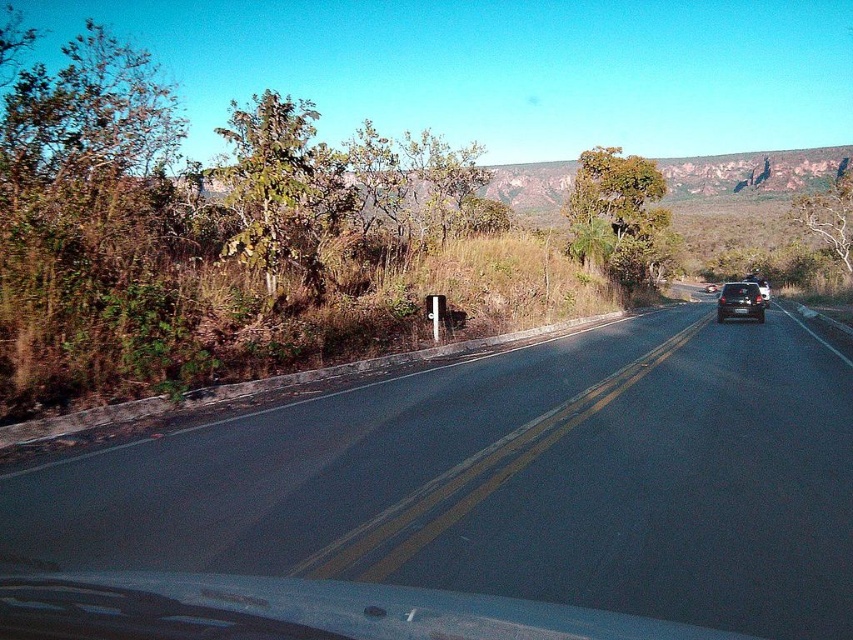
You are driving a car that is exactly the same width as the satin black car at right. You need to cross a bridge ahead that has a weight limit sign stating it can only handle vehicles up to the width of the black asphalt road at center. Will your car fit through the bridge?

The black asphalt road at center is wider than the satin black car at right. Since the bridge can handle vehicles up to the road width, your car, being narrower than the road, will fit through the bridge.

You are driving a car and want to know if there is enough space to safely pass another vehicle on the road. Based on the scene, can you determine if the black asphalt road at center has enough width for safe passing considering the satin black car at right?

The black asphalt road at center is below the satin black car at right, which indicates that the car is positioned higher than the road. However, the road has two lanes, so there should be enough width for safe passing as long as the driver follows traffic rules and checks for oncoming vehicles.

You are a delivery driver navigating a route and need to stay on the black asphalt road at center. According to the map, the road is at coordinates 0.752, 0.597. Is this coordinate accurate based on the scene?

The black asphalt road at center is indeed located at point (x=508, y=481) according to the description, so the coordinate is accurate.